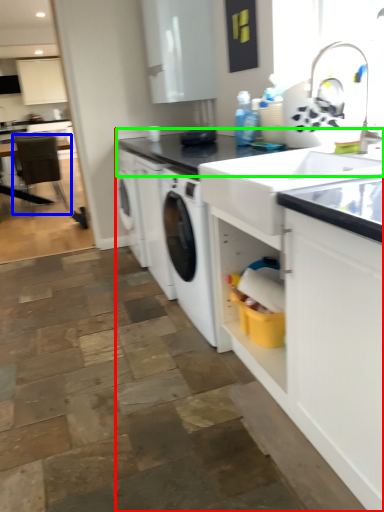
Question: Considering the real-world distances, which object is farthest from countertop (highlighted by a red box)? chair (highlighted by a blue box) or countertop (highlighted by a green box)?

Choices:
 (A) chair
 (B) countertop

Answer: (A)